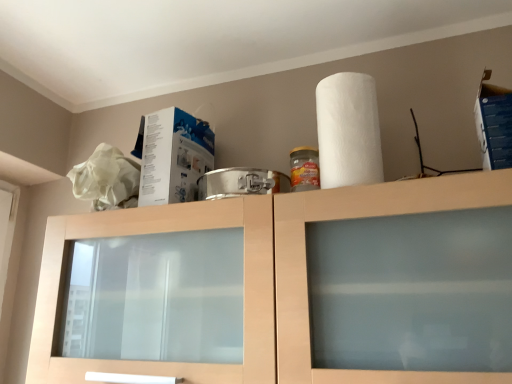
Question: From a real-world perspective, is blue cardboard box at upper right, which is the 1th box from right to left, on top of white cardboard box at upper left, the first box positioned from the back?

Choices:
 (A) no
 (B) yes

Answer: (B)

Question: Considering the relative positions of blue cardboard box at upper right, which is the first box from front to back, and white cardboard box at upper left, arranged as the 2th box when viewed from the front, in the image provided, is blue cardboard box at upper right, which is the first box from front to back, in front of white cardboard box at upper left, arranged as the 2th box when viewed from the front,?

Choices:
 (A) no
 (B) yes

Answer: (B)

Question: Is blue cardboard box at upper right, acting as the 2th box starting from the left, turned away from white cardboard box at upper left, marked as the 2th box in a right-to-left arrangement?

Choices:
 (A) no
 (B) yes

Answer: (A)

Question: Does blue cardboard box at upper right, the 2th box from the back, appear on the left side of white cardboard box at upper left, arranged as the 2th box when viewed from the front?

Choices:
 (A) yes
 (B) no

Answer: (B)

Question: Is blue cardboard box at upper right, which is the first box from front to back, far from white cardboard box at upper left, marked as the 2th box in a right-to-left arrangement?

Choices:
 (A) no
 (B) yes

Answer: (A)

Question: Could you tell me if blue cardboard box at upper right, which is the 1th box from right to left, is turned towards white cardboard box at upper left, the first box viewed from the left?

Choices:
 (A) no
 (B) yes

Answer: (A)

Question: Does white textured paper towel at upper right have a lesser width compared to matte wood cabinet at center?

Choices:
 (A) no
 (B) yes

Answer: (B)

Question: Is white textured paper towel at upper right wider than matte wood cabinet at center?

Choices:
 (A) yes
 (B) no

Answer: (B)

Question: Considering the relative positions of white textured paper towel at upper right and matte wood cabinet at center in the image provided, is white textured paper towel at upper right in front of matte wood cabinet at center?

Choices:
 (A) yes
 (B) no

Answer: (B)

Question: Can you confirm if white textured paper towel at upper right is positioned to the left of matte wood cabinet at center?

Choices:
 (A) no
 (B) yes

Answer: (A)

Question: From the image's perspective, is white textured paper towel at upper right over matte wood cabinet at center?

Choices:
 (A) yes
 (B) no

Answer: (A)

Question: Is white textured paper towel at upper right looking in the opposite direction of matte wood cabinet at center?

Choices:
 (A) no
 (B) yes

Answer: (A)

Question: Are blue cardboard box at upper right, acting as the 2th box starting from the left, and white textured paper towel at upper right located far from each other?

Choices:
 (A) yes
 (B) no

Answer: (B)